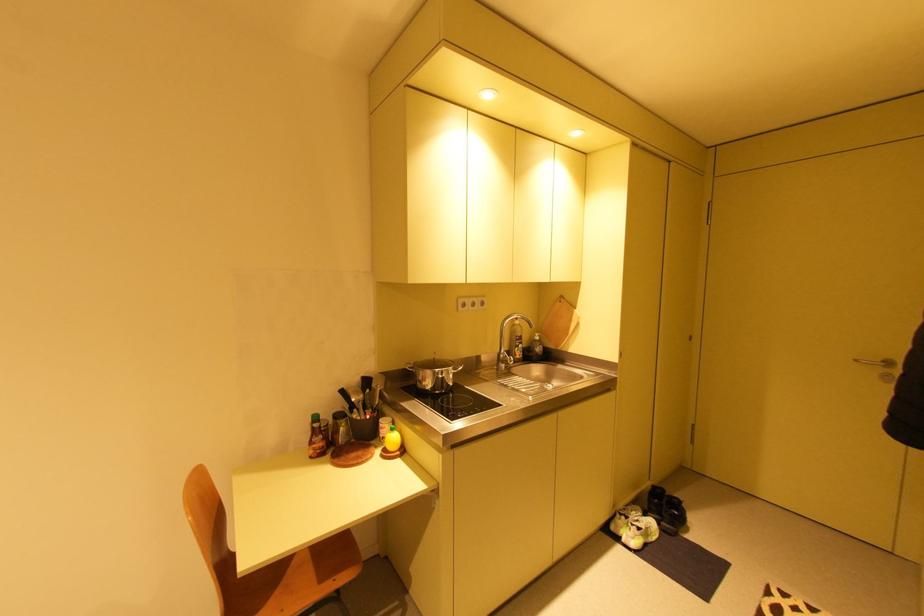
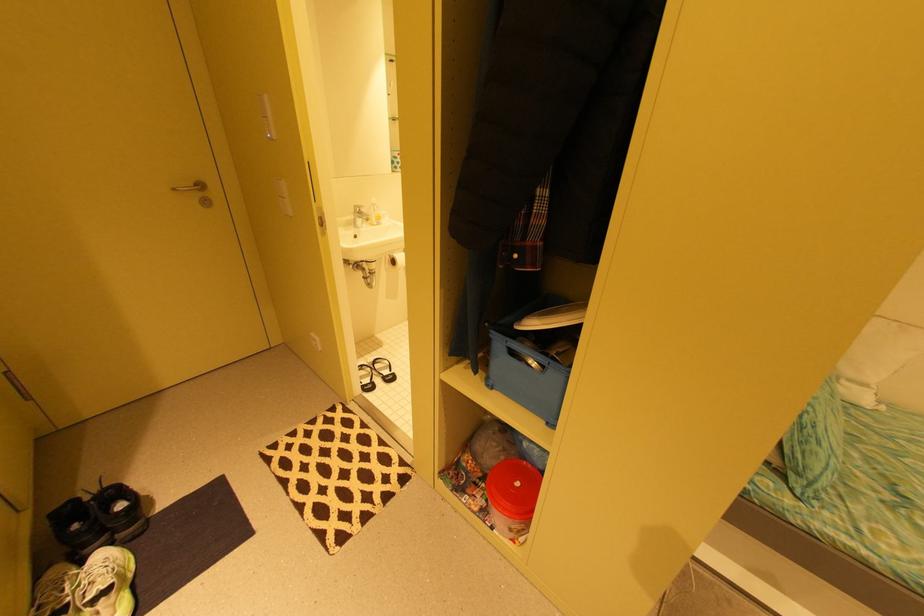
Locate, in the second image, the point that corresponds to [670,490] in the first image.

(82, 501)